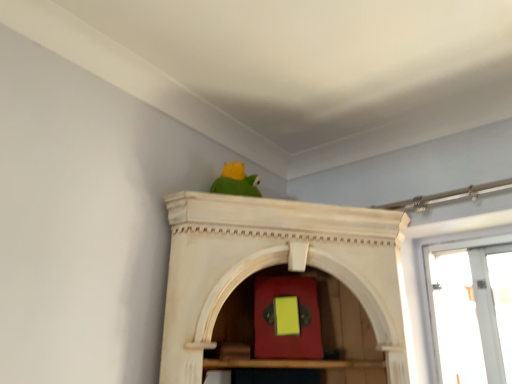
The image size is (512, 384). Describe the element at coordinates (280, 317) in the screenshot. I see `matte red cabinet at center` at that location.

Locate an element on the screen. matte red cabinet at center is located at coordinates (280, 317).

Identify the location of matte red cabinet at center. Image resolution: width=512 pixels, height=384 pixels. point(280,317).